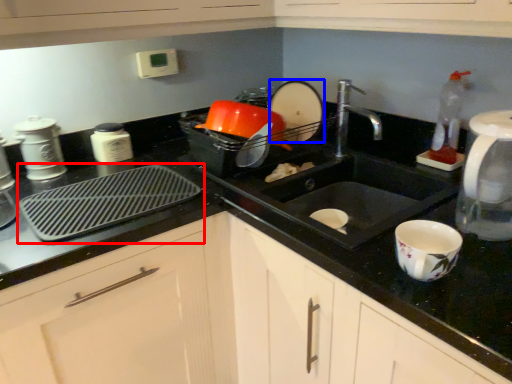
Question: Which object appears closest to the camera in this image, kitchen appliance (highlighted by a red box) or appliance (highlighted by a blue box)?

Choices:
 (A) kitchen appliance
 (B) appliance

Answer: (A)